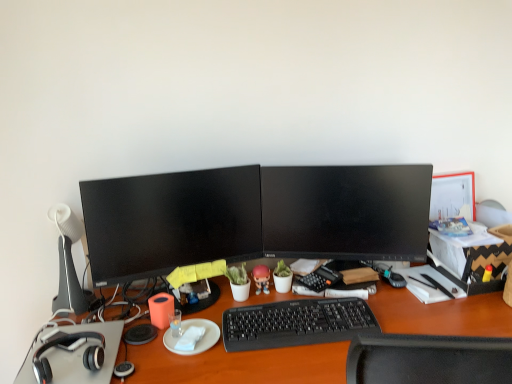
This screenshot has height=384, width=512. Find the location of `free spot to the left of white paper at center`. free spot to the left of white paper at center is located at coordinates (145, 340).